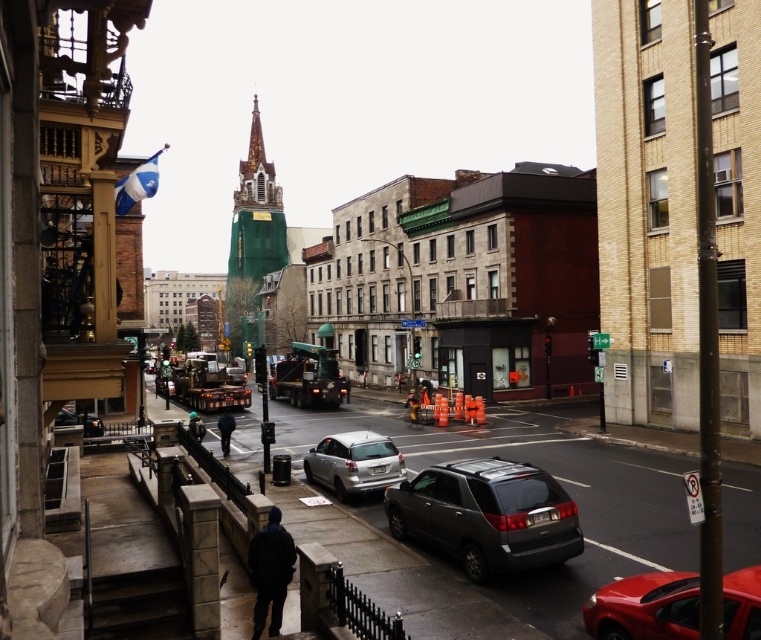
You are a delivery drone flying over the urban street scene. You need to drop a package at point A and then proceed to point B. Given that point A is point (271, 536) and point B is point (236, 374), which point should you visit first to ensure you can reach both points without needing to go around obstacles?

You should visit point A first because it is closer to the camera, so it is nearer to your current position as the drone, allowing you to reach point B afterward without needing to backtrack through obstacles.

Looking at this image, based on the scene description, where is the dark blue fabric construction worker at lower center located in terms of coordinates?

The dark blue fabric construction worker at lower center is located at coordinates point (269,572).